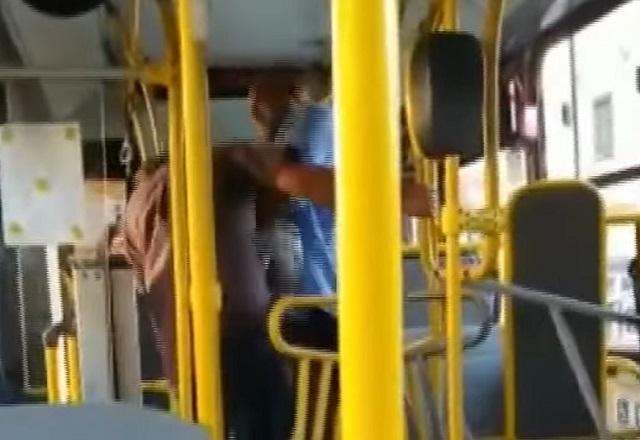
Locate an element on the screen. This screenshot has width=640, height=440. window is located at coordinates (621, 113).